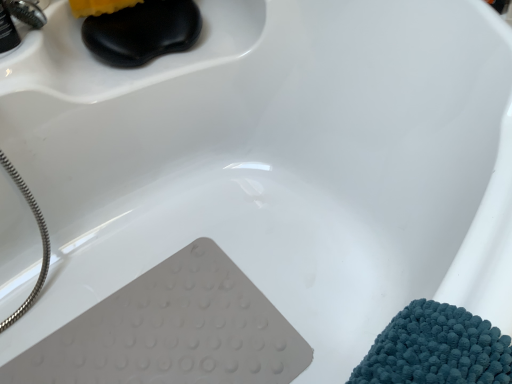
Question: Are brushed metal faucet at upper left, the second faucet in the front-to-back sequence, and brushed metal faucet at upper left, which is the 2th faucet from back to front, making contact?

Choices:
 (A) yes
 (B) no

Answer: (A)

Question: From a real-world perspective, is brushed metal faucet at upper left, placed as the first faucet when sorted from back to front, located beneath brushed metal faucet at upper left, which is the 2th faucet from back to front?

Choices:
 (A) yes
 (B) no

Answer: (A)

Question: From the image's perspective, is brushed metal faucet at upper left, placed as the first faucet when sorted from back to front, located above brushed metal faucet at upper left, which is the 2th faucet from back to front?

Choices:
 (A) no
 (B) yes

Answer: (B)

Question: Is brushed metal faucet at upper left, placed as the first faucet when sorted from back to front, positioned in front of brushed metal faucet at upper left, which ranks as the first faucet in front-to-back order?

Choices:
 (A) no
 (B) yes

Answer: (A)

Question: Is brushed metal faucet at upper left, the second faucet in the front-to-back sequence, oriented away from brushed metal faucet at upper left, which is the 2th faucet from back to front?

Choices:
 (A) no
 (B) yes

Answer: (A)

Question: Is the position of brushed metal faucet at upper left, placed as the first faucet when sorted from back to front, more distant than that of brushed metal faucet at upper left, which is the 2th faucet from back to front?

Choices:
 (A) yes
 (B) no

Answer: (A)

Question: Is brushed metal faucet at upper left, which ranks as the first faucet in front-to-back order, far from brushed metal faucet at upper left, the second faucet in the front-to-back sequence?

Choices:
 (A) no
 (B) yes

Answer: (A)

Question: Considering the relative sizes of brushed metal faucet at upper left, which is the 2th faucet from back to front, and brushed metal faucet at upper left, the second faucet in the front-to-back sequence, in the image provided, is brushed metal faucet at upper left, which is the 2th faucet from back to front, bigger than brushed metal faucet at upper left, the second faucet in the front-to-back sequence,?

Choices:
 (A) no
 (B) yes

Answer: (B)

Question: From the image's perspective, is brushed metal faucet at upper left, which ranks as the first faucet in front-to-back order, located above brushed metal faucet at upper left, the second faucet in the front-to-back sequence?

Choices:
 (A) no
 (B) yes

Answer: (A)

Question: Is brushed metal faucet at upper left, which ranks as the first faucet in front-to-back order, aimed at brushed metal faucet at upper left, placed as the first faucet when sorted from back to front?

Choices:
 (A) no
 (B) yes

Answer: (A)

Question: Considering the relative positions of brushed metal faucet at upper left, which is the 2th faucet from back to front, and brushed metal faucet at upper left, the second faucet in the front-to-back sequence, in the image provided, is brushed metal faucet at upper left, which is the 2th faucet from back to front, behind brushed metal faucet at upper left, the second faucet in the front-to-back sequence,?

Choices:
 (A) no
 (B) yes

Answer: (A)

Question: Could brushed metal faucet at upper left, the second faucet in the front-to-back sequence, be considered to be inside brushed metal faucet at upper left, which is the 2th faucet from back to front?

Choices:
 (A) no
 (B) yes

Answer: (A)

Question: From the image's perspective, is brushed metal faucet at upper left, placed as the first faucet when sorted from back to front, above or below brushed metal faucet at upper left, which is the 2th faucet from back to front?

Choices:
 (A) below
 (B) above

Answer: (B)